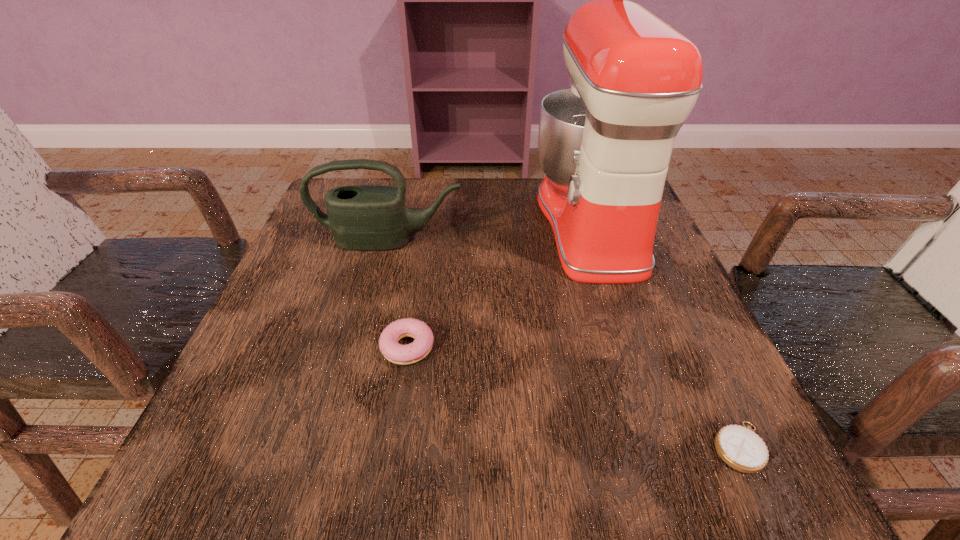
Locate an element on the screen. the tallest object is located at coordinates (605, 143).

Identify the location of the second tallest object. (362, 217).

Locate an element on the screen. This screenshot has width=960, height=540. doughnut is located at coordinates (413, 352).

You are a GUI agent. You are given a task and a screenshot of the screen. Output one action in this format:
    pyautogui.click(x=<x>, y=<y>)
    Task: Click on the third tallest object
    
    Given the screenshot: What is the action you would take?
    [413, 352]

This screenshot has height=540, width=960. I want to click on the nearest object, so click(740, 447).

You are a GUI agent. You are given a task and a screenshot of the screen. Output one action in this format:
    pyautogui.click(x=<x>, y=<y>)
    Task: Click on the shortest object
    The height and width of the screenshot is (540, 960).
    Given the screenshot: What is the action you would take?
    pyautogui.click(x=740, y=447)

What are the coordinates of `free space located 0.150m on the front-facing side of the mixer` in the screenshot? It's located at (468, 224).

This screenshot has width=960, height=540. In order to click on vacant space situated on the front-facing side of the mixer in this screenshot , I will do `click(427, 224)`.

This screenshot has height=540, width=960. Identify the location of vacant space located on the front-facing side of the mixer. (464, 224).

Where is `free space located on the spout of the third shortest object`? This screenshot has height=540, width=960. free space located on the spout of the third shortest object is located at coordinates (344, 414).